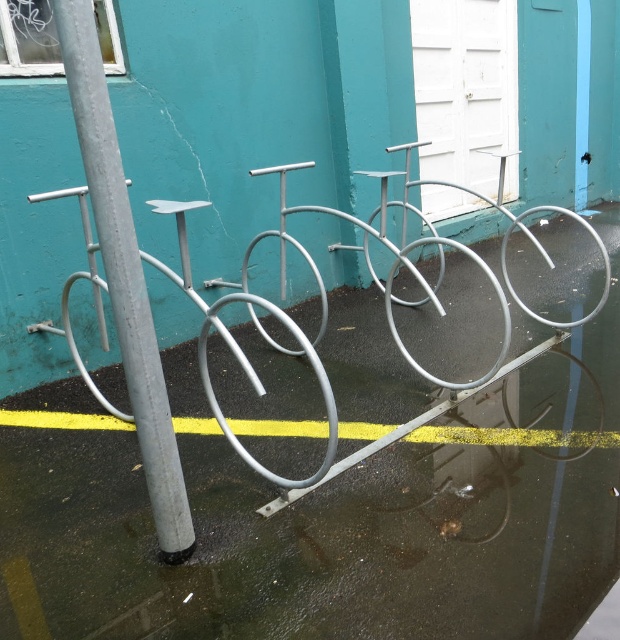
You are standing in front of the teal wall with the bicycle rack. You see the smooth gray pole at left and the metallic silver bicycle at left. Which object is positioned more to the left?

The metallic silver bicycle at left is more to the left since the smooth gray pole at left is to its right.

You are a delivery person who needs to park your metallic silver bicycle at left within the area marked by the yellow painted line at lower center. Based on the scene, can you fit your bicycle inside the marked area?

The metallic silver bicycle at left has a larger size compared to yellow painted line at lower center, so it may not fit entirely within the marked area. Check the exact dimensions before parking.

From the picture: You are standing in front of the bicycle rack and notice two points marked on the ground. The first point is at coordinates point (143, 468) and the second is at point (24, 417). Which point is closer to your current position?

Point (143, 468) is closer to the camera than point (24, 417), so the first point is closer to your current position.